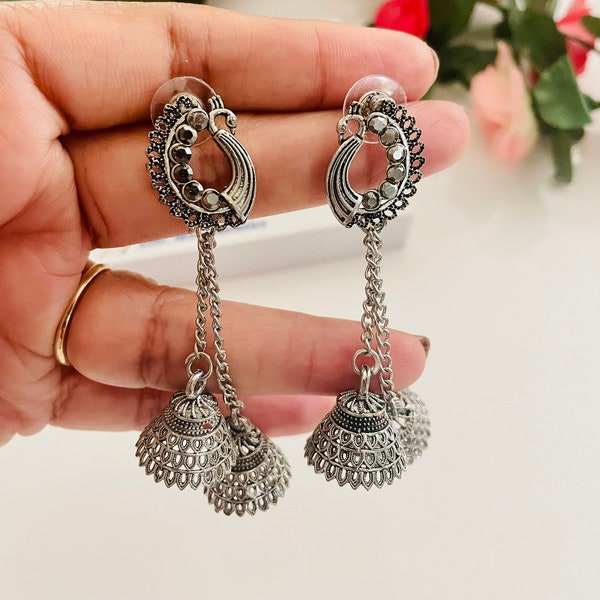
Find the location of a particular element. wall is located at coordinates (481, 463).